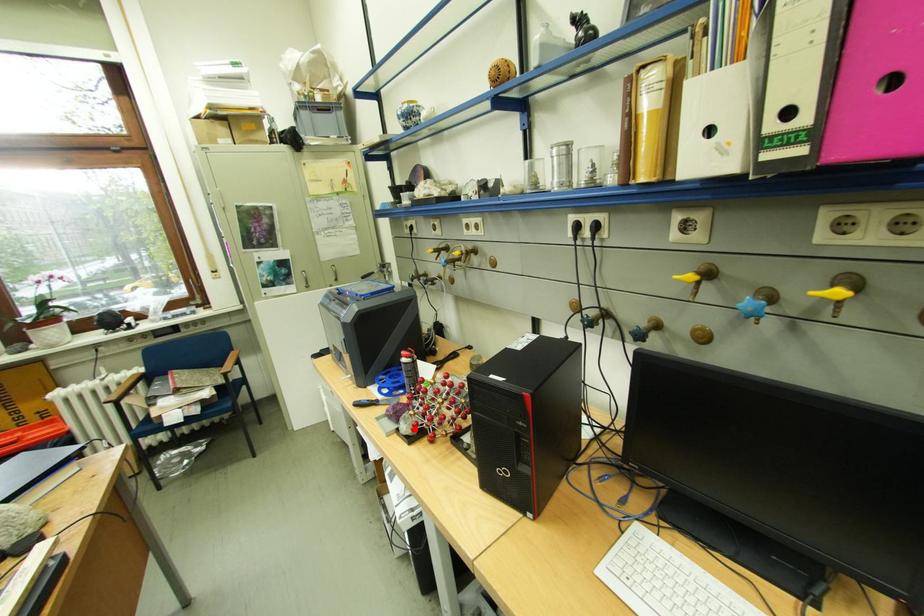
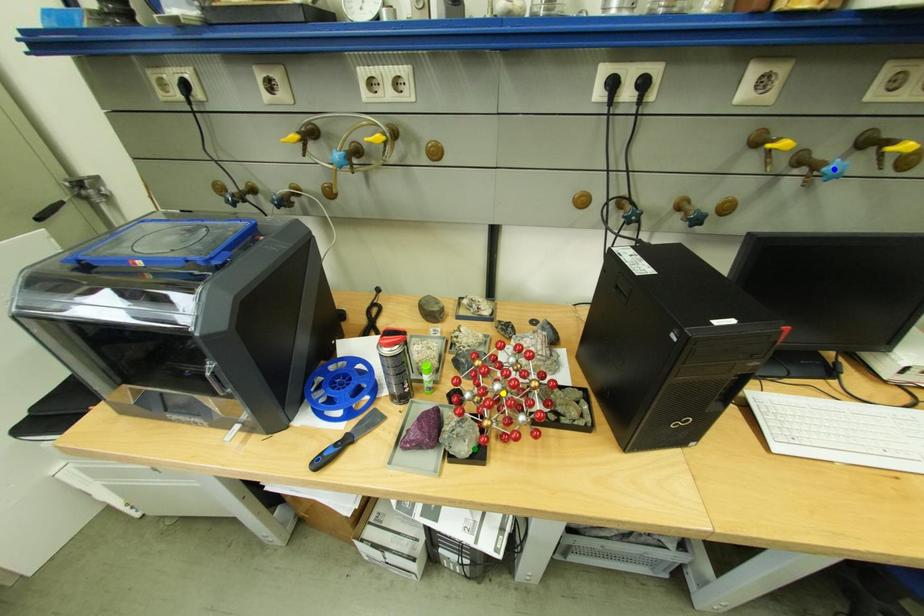
Question: I am providing you with two images of the same scene from different viewpoints. A red point is marked on the first image. You are given multiple points on the second image. Which point in image 2 is actually the same real-world point as the red point in image 1?

Choices:
 (A) blue point
 (B) green point
 (C) yellow point

Answer: (B)